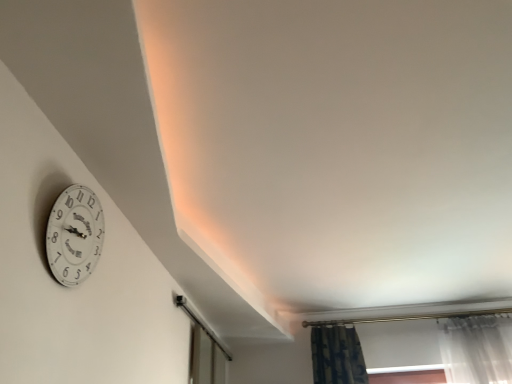
Question: Is point (72, 220) closer or farther from the camera than point (195, 314)?

Choices:
 (A) farther
 (B) closer

Answer: (B)

Question: In the image, is white glossy clock at upper left on the left side or the right side of transparent glass door at lower center?

Choices:
 (A) right
 (B) left

Answer: (B)

Question: From the image's perspective, is white glossy clock at upper left above or below transparent glass door at lower center?

Choices:
 (A) above
 (B) below

Answer: (A)

Question: Is transparent glass door at lower center inside or outside of white glossy clock at upper left?

Choices:
 (A) inside
 (B) outside

Answer: (B)

Question: In terms of width, does transparent glass door at lower center look wider or thinner when compared to white glossy clock at upper left?

Choices:
 (A) wide
 (B) thin

Answer: (A)

Question: Relative to white glossy clock at upper left, is transparent glass door at lower center in front or behind?

Choices:
 (A) front
 (B) behind

Answer: (B)

Question: Is point (179, 302) closer or farther from the camera than point (50, 246)?

Choices:
 (A) farther
 (B) closer

Answer: (A)